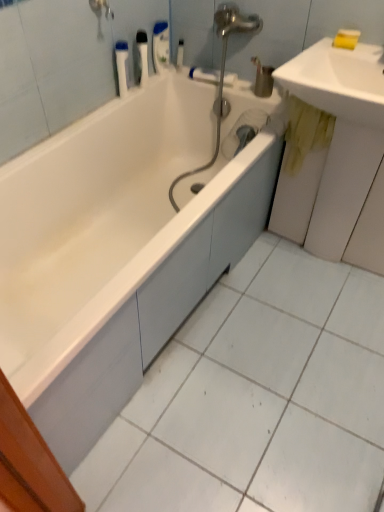
This screenshot has width=384, height=512. Identify the location of white glossy bathtub at center. (117, 250).

The height and width of the screenshot is (512, 384). What do you see at coordinates (117, 250) in the screenshot?
I see `white glossy bathtub at center` at bounding box center [117, 250].

Image resolution: width=384 pixels, height=512 pixels. What do you see at coordinates (122, 67) in the screenshot?
I see `white plastic container at upper left, the fourth toiletry when ordered from right to left` at bounding box center [122, 67].

Image resolution: width=384 pixels, height=512 pixels. What do you see at coordinates (337, 155) in the screenshot?
I see `yellow stained wood at right` at bounding box center [337, 155].

This screenshot has height=512, width=384. Identify the location of white plastic bottle at upper center, the 3th toiletry from the right. (142, 55).

The width and height of the screenshot is (384, 512). What do you see at coordinates (222, 106) in the screenshot?
I see `matte silver faucet at center` at bounding box center [222, 106].

From the picture: How much space does white plastic bottle at upper center, acting as the second toiletry starting from the right, occupy vertically?

white plastic bottle at upper center, acting as the second toiletry starting from the right, is 8.30 inches tall.

Locate an element on the screen. The width and height of the screenshot is (384, 512). white plastic bottle at upper center, the 4th toiletry positioned from the left is located at coordinates (180, 54).

Is white glossy bathtub at center in front of or behind white plastic bottle at upper center, the 4th toiletry positioned from the left, in the image?

white glossy bathtub at center is positioned closer to the viewer than white plastic bottle at upper center, the 4th toiletry positioned from the left.

From a real-world perspective, which is physically below, white glossy bathtub at center or white plastic bottle at upper center, the 4th toiletry positioned from the left?

In real-world perspective, white glossy bathtub at center is lower.

Between white glossy bathtub at center and white plastic bottle at upper center, the 4th toiletry positioned from the left, which one has smaller size?

white plastic bottle at upper center, the 4th toiletry positioned from the left, is smaller.

From the image's perspective, which object appears higher, white glossy bathtub at center or white plastic bottle at upper center, the 4th toiletry positioned from the left?

white plastic bottle at upper center, the 4th toiletry positioned from the left, appears higher in the image.

Could you tell me if matte silver faucet at center is facing white plastic bottle at upper center, which is counted as the 3th toiletry, starting from the left?

No, matte silver faucet at center is not turned towards white plastic bottle at upper center, which is counted as the 3th toiletry, starting from the left.

From the image's perspective, which object appears higher, matte silver faucet at center or white plastic bottle at upper center, acting as the second toiletry starting from the right?

white plastic bottle at upper center, acting as the second toiletry starting from the right.

Which object is more forward, matte silver faucet at center or white plastic bottle at upper center, acting as the second toiletry starting from the right?

Positioned in front is white plastic bottle at upper center, acting as the second toiletry starting from the right.

Does matte silver faucet at center have a lesser width compared to white plastic bottle at upper center, acting as the second toiletry starting from the right?

Indeed, matte silver faucet at center has a lesser width compared to white plastic bottle at upper center, acting as the second toiletry starting from the right.

Is white plastic bottle at upper center, which is counted as the 1th toiletry, starting from the right, in contact with matte silver faucet at center?

No, white plastic bottle at upper center, which is counted as the 1th toiletry, starting from the right, is not touching matte silver faucet at center.

From the image's perspective, between white plastic bottle at upper center, the 4th toiletry positioned from the left, and matte silver faucet at center, which one is located above?

From the image's view, white plastic bottle at upper center, the 4th toiletry positioned from the left, is above.

Who is taller, white plastic bottle at upper center, the 4th toiletry positioned from the left, or matte silver faucet at center?

white plastic bottle at upper center, the 4th toiletry positioned from the left, is taller.

Is white plastic bottle at upper center, which is counted as the 1th toiletry, starting from the right, wider or thinner than matte silver faucet at center?

Clearly, white plastic bottle at upper center, which is counted as the 1th toiletry, starting from the right, has more width compared to matte silver faucet at center.

Can you confirm if matte silver faucet at center is wider than white glossy bathtub at center?

No.

Is matte silver faucet at center shorter than white glossy bathtub at center?

Yes, matte silver faucet at center is shorter than white glossy bathtub at center.

Consider the image. Is matte silver faucet at center turned away from white glossy bathtub at center?

Absolutely, matte silver faucet at center is directed away from white glossy bathtub at center.

Does matte silver faucet at center touch white glossy bathtub at center?

No, matte silver faucet at center is not beside white glossy bathtub at center.

Looking at their sizes, would you say white glossy bathtub at center is wider or thinner than white glossy sink at upper right?

In the image, white glossy bathtub at center appears to be wider than white glossy sink at upper right.

Is point (188, 244) closer to camera compared to point (345, 116)?

Yes, point (188, 244) is in front of point (345, 116).

From the image's perspective, which is above, white glossy bathtub at center or white glossy sink at upper right?

white glossy sink at upper right, from the image's perspective.

Is white glossy bathtub at center looking in the opposite direction of white glossy sink at upper right?

A: No, white glossy bathtub at center is not facing away from white glossy sink at upper right.

Identify the location of sink positioned vertically above the white glossy bathtub at center (from a real-world perspective). The height and width of the screenshot is (512, 384). (339, 81).

Which is more distant, (317, 66) or (166, 138)?

Positioned behind is point (166, 138).

From a real-world perspective, does white glossy sink at upper right stand above white glossy bathtub at center?

Yes, from a real-world perspective, white glossy sink at upper right is above white glossy bathtub at center.

Is white plastic container at upper left, which is the 1th toiletry in left-to-right order, positioned with its back to yellow stained wood at right?

That's not correct — white plastic container at upper left, which is the 1th toiletry in left-to-right order, is not looking away from yellow stained wood at right.

From a real-world perspective, relative to yellow stained wood at right, is white plastic container at upper left, the fourth toiletry when ordered from right to left, vertically above or below?

In terms of real-world spatial position, white plastic container at upper left, the fourth toiletry when ordered from right to left, is above yellow stained wood at right.

I want to click on counter top beneath the white plastic container at upper left, which is the 1th toiletry in left-to-right order (from a real-world perspective), so click(337, 155).

Who is taller, white plastic container at upper left, which is the 1th toiletry in left-to-right order, or yellow stained wood at right?

yellow stained wood at right is taller.

What are the coordinates of `the 3rd toiletry counting from the right of the white glossy bathtub at center` in the screenshot? It's located at (180, 54).

At what (x,y) coordinates should I click in order to perform the action: click on toiletry that is the 3rd object above the matte silver faucet at center (from a real-world perspective). Please return your answer as a coordinate pair (x, y). This screenshot has height=512, width=384. Looking at the image, I should click on (160, 46).

Looking at the image, which one is located further to white glossy sink at upper right, yellow stained wood at right or white plastic bottle at upper center, the 2th toiletry viewed from the left?

white plastic bottle at upper center, the 2th toiletry viewed from the left.

Based on their spatial positions, is yellow stained wood at right or white plastic container at upper left, the fourth toiletry when ordered from right to left, further from white glossy sink at upper right?

white plastic container at upper left, the fourth toiletry when ordered from right to left, is positioned further to the anchor white glossy sink at upper right.

Based on their spatial positions, is yellow stained wood at right or matte silver faucet at center closer to white plastic container at upper left, the fourth toiletry when ordered from right to left?

The object closer to white plastic container at upper left, the fourth toiletry when ordered from right to left, is matte silver faucet at center.

From the image, which object appears to be nearer to yellow stained wood at right, white glossy bathtub at center or white plastic bottle at upper center, which is counted as the 3th toiletry, starting from the left?

Among the two, white glossy bathtub at center is located nearer to yellow stained wood at right.

Estimate the real-world distances between objects in this image. Which object is further from white plastic bottle at upper center, the 4th toiletry positioned from the left, white glossy bathtub at center or white plastic container at upper left, which is the 1th toiletry in left-to-right order?

white glossy bathtub at center.

From the image, which object appears to be nearer to white plastic bottle at upper center, the 3th toiletry from the right, white glossy bathtub at center or yellow stained wood at right?

white glossy bathtub at center is closer to white plastic bottle at upper center, the 3th toiletry from the right.

Estimate the real-world distances between objects in this image. Which object is further from white glossy sink at upper right, white glossy bathtub at center or white plastic bottle at upper center, the 3th toiletry from the right?

white plastic bottle at upper center, the 3th toiletry from the right.

Based on their spatial positions, is white plastic bottle at upper center, the 4th toiletry positioned from the left, or white plastic container at upper left, the fourth toiletry when ordered from right to left, further from matte silver faucet at center?

white plastic container at upper left, the fourth toiletry when ordered from right to left, lies further to matte silver faucet at center than the other object.

Where is `plumbing fixture between white glossy bathtub at center and white plastic bottle at upper center, which is counted as the 1th toiletry, starting from the right, from front to back`? The image size is (384, 512). plumbing fixture between white glossy bathtub at center and white plastic bottle at upper center, which is counted as the 1th toiletry, starting from the right, from front to back is located at coordinates (222, 106).

The height and width of the screenshot is (512, 384). What are the coordinates of `sink situated between white plastic bottle at upper center, the 2th toiletry viewed from the left, and yellow stained wood at right from left to right` in the screenshot? It's located at (339, 81).

Where is `sink located between white glossy bathtub at center and yellow stained wood at right in the left-right direction`? The image size is (384, 512). sink located between white glossy bathtub at center and yellow stained wood at right in the left-right direction is located at coordinates (339, 81).

Find the location of `sink between white plastic bottle at upper center, acting as the second toiletry starting from the right, and yellow stained wood at right, in the horizontal direction`. sink between white plastic bottle at upper center, acting as the second toiletry starting from the right, and yellow stained wood at right, in the horizontal direction is located at coordinates (339, 81).